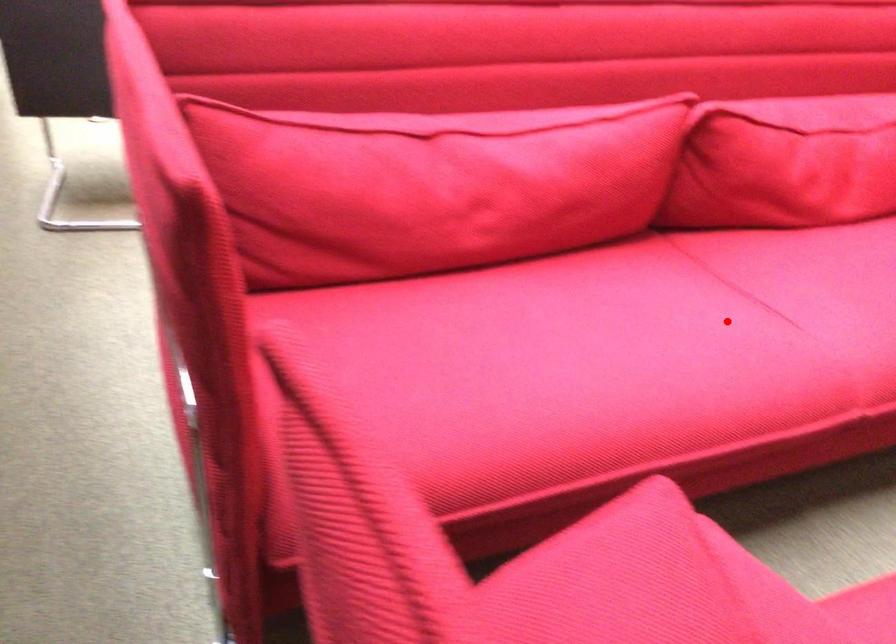
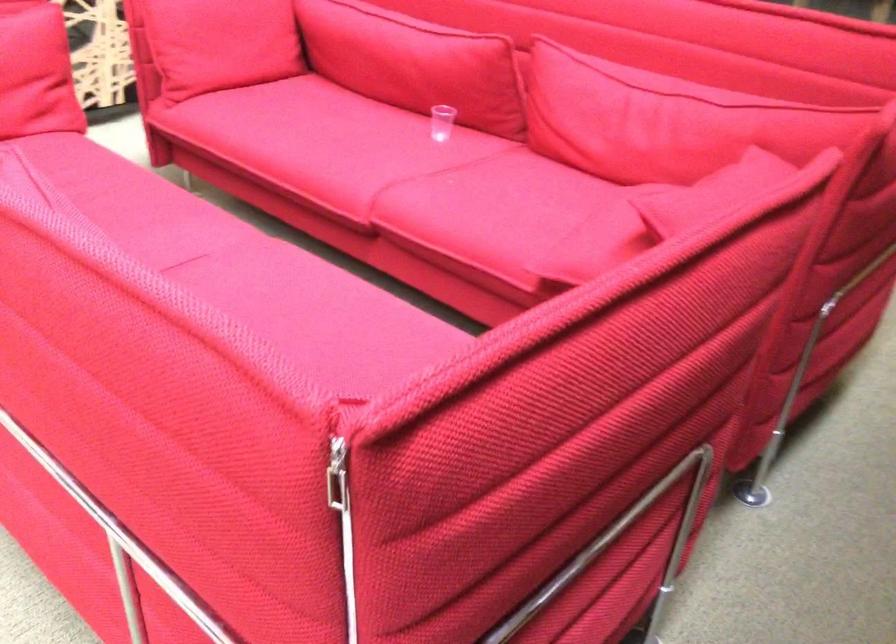
Where in the second image is the point corresponding to the highlighted location from the first image?

(244, 270)